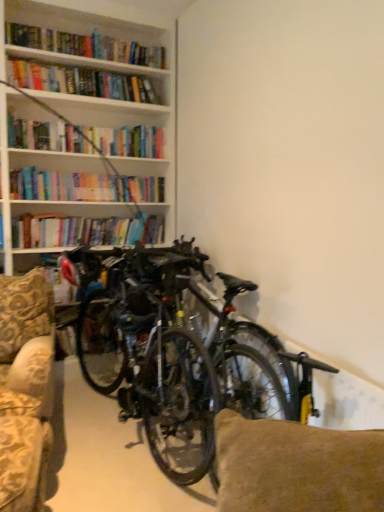
This screenshot has width=384, height=512. What do you see at coordinates (175, 352) in the screenshot?
I see `shiny metallic bicycle at center` at bounding box center [175, 352].

The image size is (384, 512). I want to click on shiny metallic bicycle at center, so click(175, 352).

Where is `shiny metallic bicycle at center`? shiny metallic bicycle at center is located at coordinates (175, 352).